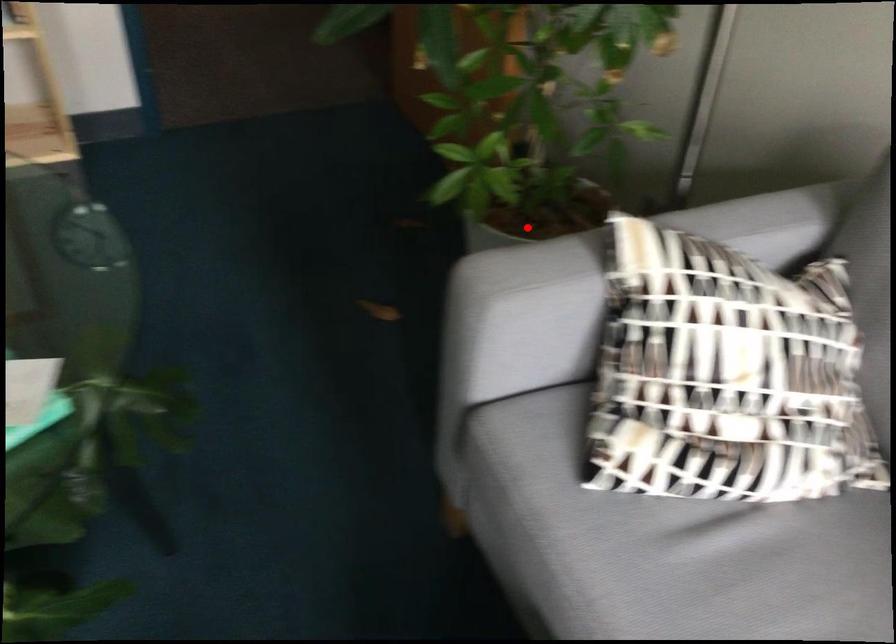
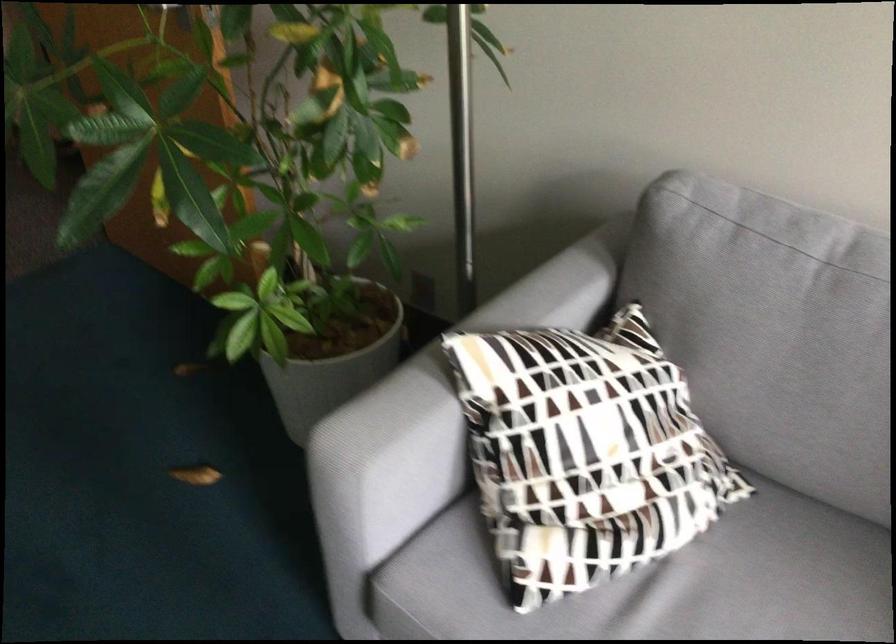
Where in the second image is the point corresponding to the highlighted location from the first image?

(332, 355)